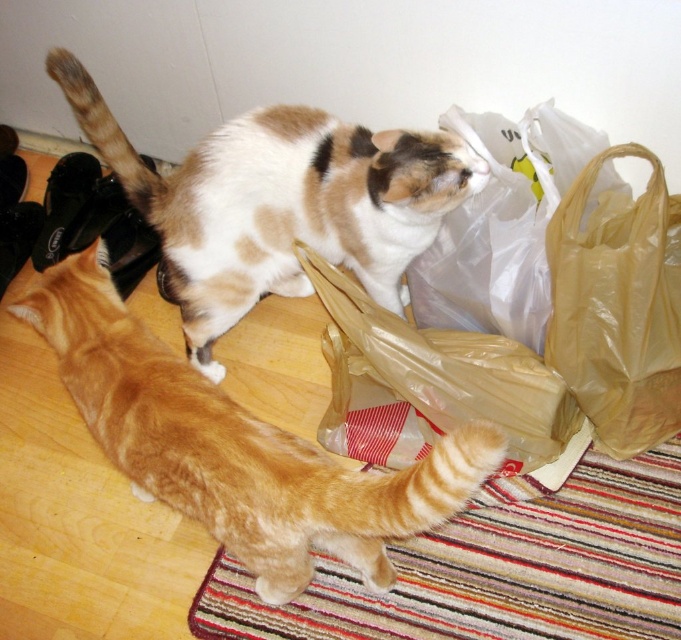
Question: Which point is farther to the camera?

Choices:
 (A) (535, 408)
 (B) (466, 212)

Answer: (B)

Question: Does orange tabby cat at lower left lie behind translucent plastic bag at upper right?

Choices:
 (A) yes
 (B) no

Answer: (B)

Question: Considering the relative positions of translucent plastic bag at center and translucent plastic bag at upper right in the image provided, where is translucent plastic bag at center located with respect to translucent plastic bag at upper right?

Choices:
 (A) above
 (B) below

Answer: (B)

Question: Considering the real-world distances, which object is farthest from the translucent plastic bag at upper right?

Choices:
 (A) matte yellow plastic bag at right
 (B) orange tabby cat at lower left
 (C) translucent plastic bag at center
 (D) calico fur cat at upper center

Answer: (B)

Question: Considering the real-world distances, which object is closest to the calico fur cat at upper center?

Choices:
 (A) matte yellow plastic bag at right
 (B) orange tabby cat at lower left
 (C) translucent plastic bag at center
 (D) translucent plastic bag at upper right

Answer: (D)

Question: Can you confirm if orange tabby cat at lower left is smaller than matte yellow plastic bag at right?

Choices:
 (A) yes
 (B) no

Answer: (B)